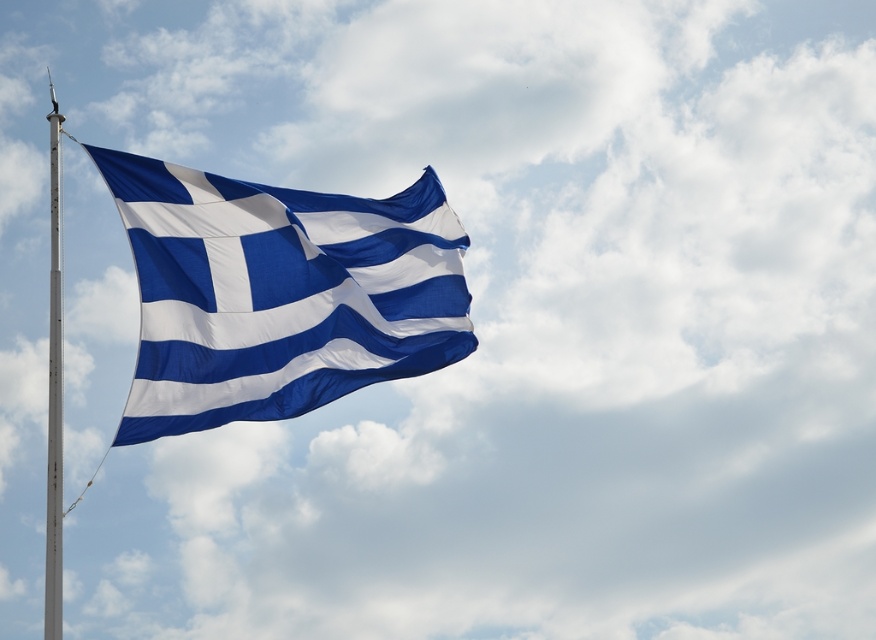
Does blue fabric flag at upper left have a greater width compared to white metallic pole at left?

No.

Is point (239, 401) in front of point (53, 184)?

Yes, it is in front of point (53, 184).

You are a GUI agent. You are given a task and a screenshot of the screen. Output one action in this format:
    pyautogui.click(x=<x>, y=<y>)
    Task: Click on the blue fabric flag at upper left
    
    Given the screenshot: What is the action you would take?
    pyautogui.click(x=277, y=294)